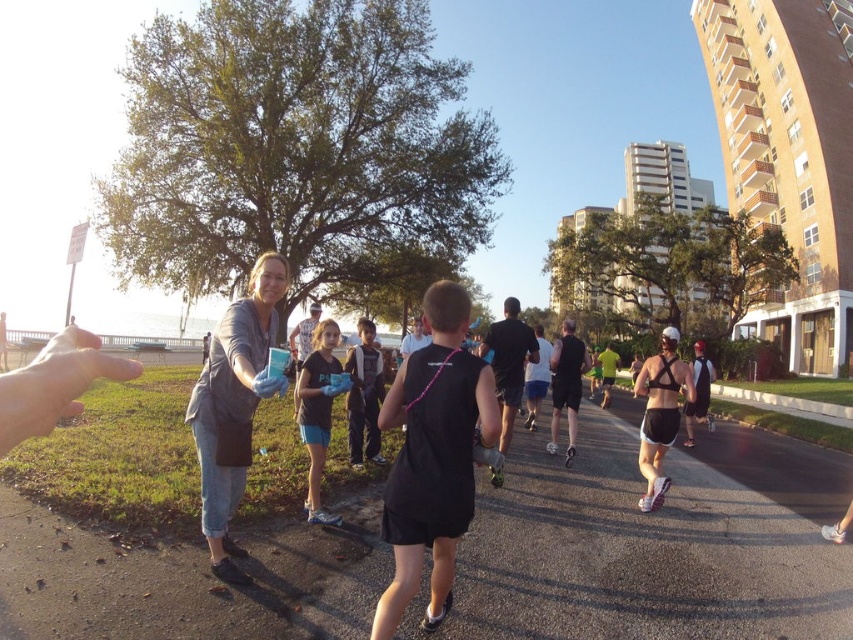
How distant is black fabric runner at center from black matte tank top at center?

black fabric runner at center and black matte tank top at center are 4.32 meters apart from each other.

At what (x,y) coordinates should I click in order to perform the action: click on black fabric runner at center. Please return your answer as a coordinate pair (x, y). The width and height of the screenshot is (853, 640). Looking at the image, I should click on (641, 556).

Is black matte tank top at center thinner than matte blue shorts at center?

No, black matte tank top at center is not thinner than matte blue shorts at center.

Is point (471, 408) positioned behind point (305, 397)?

No, it is not.

Locate an element on the screen. black matte tank top at center is located at coordinates (433, 456).

Who is more distant from viewer, (450,300) or (258,339)?

Positioned behind is point (258,339).

Between point (399, 566) and point (218, 506), which one is positioned in front?

Positioned in front is point (399, 566).

At what (x,y) coordinates should I click in order to perform the action: click on black matte tank top at center. Please return your answer as a coordinate pair (x, y). Looking at the image, I should click on (433, 456).